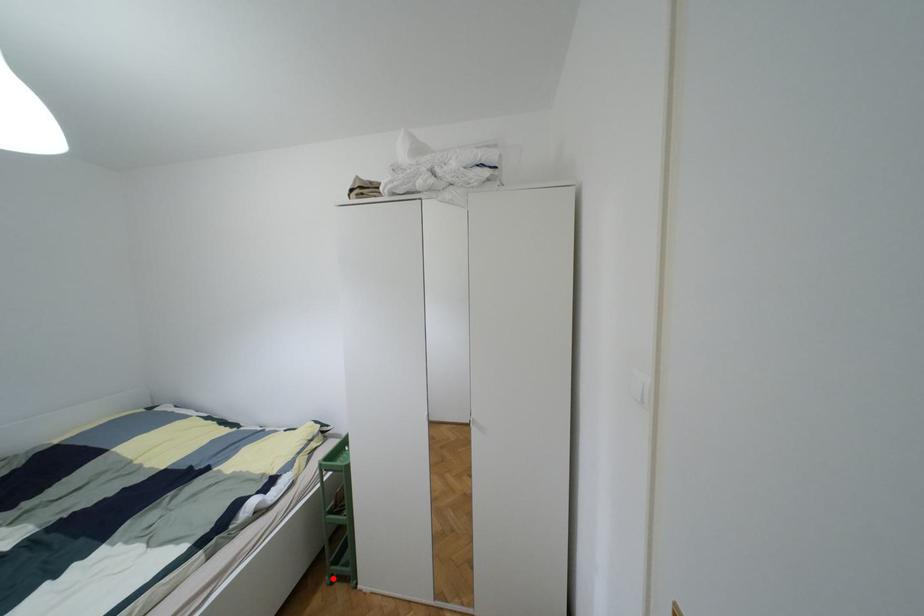
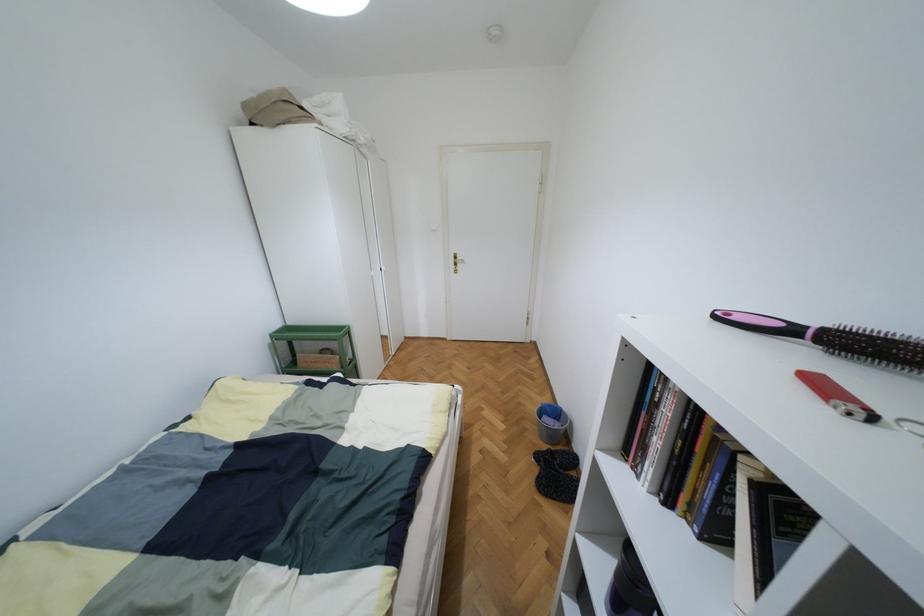
Question: I am providing you with two images of the same scene from different viewpoints. A red point is marked on the first image. Is the red point's position out of view in image 2?

Choices:
 (A) Yes
 (B) No

Answer: (A)